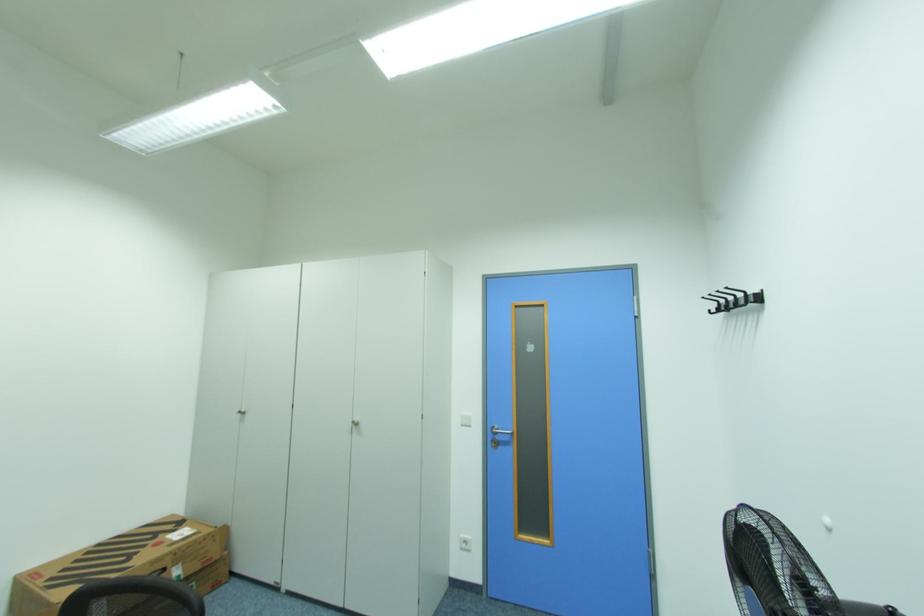
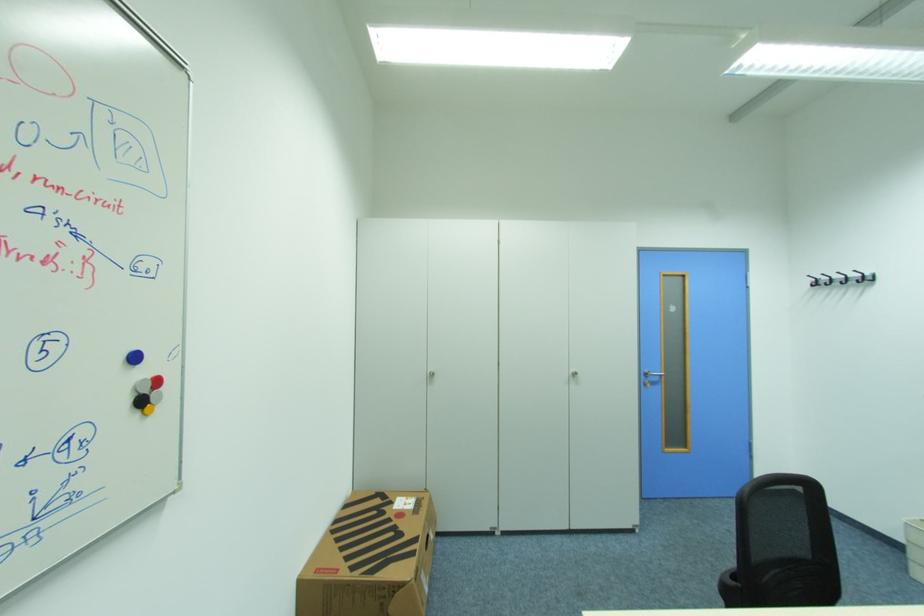
Question: Which direction would the cameraman need to move to produce the second image? Reply with the corresponding letter.

Choices:
 (A) Left
 (B) Right
 (C) Forward
 (D) Backward

Answer: (A)